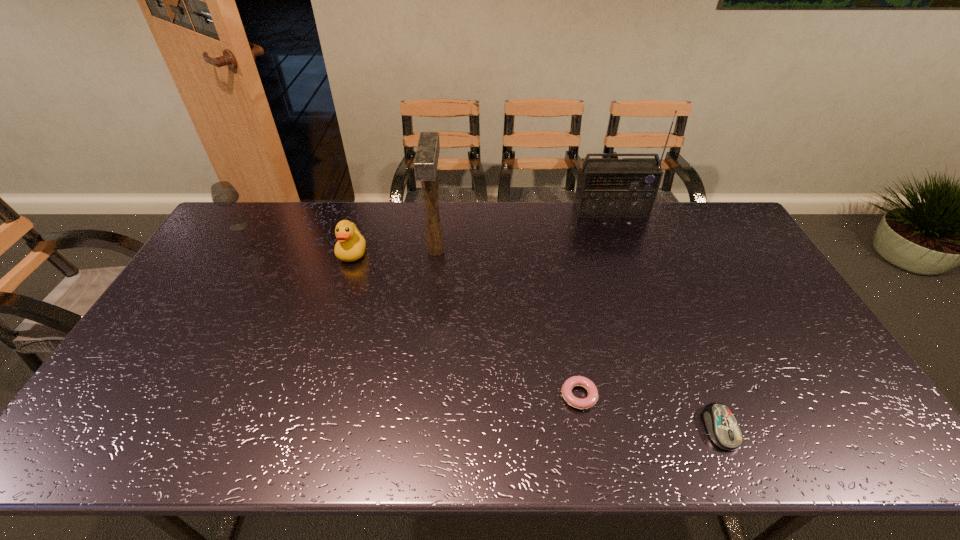
Find the location of a particular element. This screenshot has width=960, height=540. unoccupied position between the computer mouse and the farthest object is located at coordinates (665, 319).

This screenshot has width=960, height=540. I want to click on vacant area that lies between the farthest object and the fourth object from right to left, so click(523, 231).

Identify the location of unoccupied area between the shortest object and the fourth object from right to left. pos(508,323).

What are the coordinates of `free space between the fourth object from right to left and the fourth object from left to right` in the screenshot? It's located at (508, 323).

Select which object is the second closest to the mallet. Please provide its 2D coordinates. Your answer should be formatted as a tuple, i.e. [(x, y)], where the tuple contains the x and y coordinates of a point satisfying the conditions above.

[(606, 187)]

Identify which object is located as the second nearest to the radio receiver. Please provide its 2D coordinates. Your answer should be formatted as a tuple, i.e. [(x, y)], where the tuple contains the x and y coordinates of a point satisfying the conditions above.

[(592, 398)]

You are a GUI agent. You are given a task and a screenshot of the screen. Output one action in this format:
    pyautogui.click(x=<x>, y=<y>)
    Task: Click on the vacant area in the image that satisfies the following two spatial constraints: 1. at the beak of the shortest object; 2. on the left side of the third shortest object
    
    Given the screenshot: What is the action you would take?
    pyautogui.click(x=307, y=395)